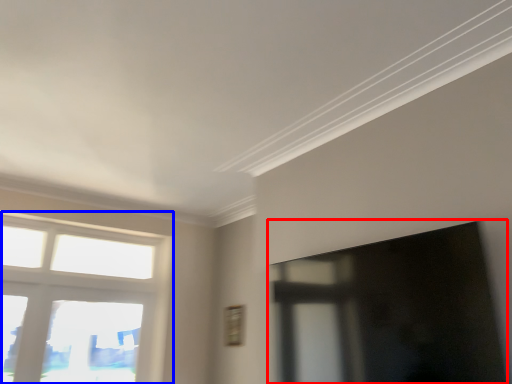
Question: Which object is further to the camera taking this photo, window screen (highlighted by a red box) or window (highlighted by a blue box)?

Choices:
 (A) window screen
 (B) window

Answer: (B)